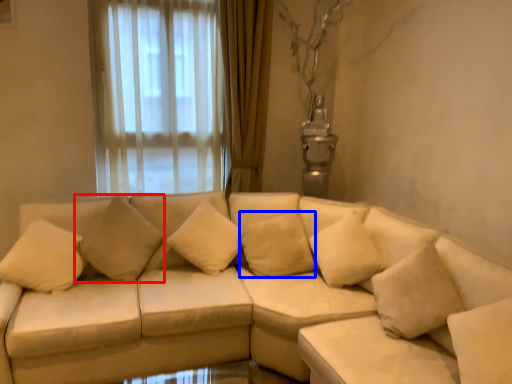
Question: Which object appears closest to the camera in this image, pillow (highlighted by a red box) or pillow (highlighted by a blue box)?

Choices:
 (A) pillow
 (B) pillow

Answer: (A)